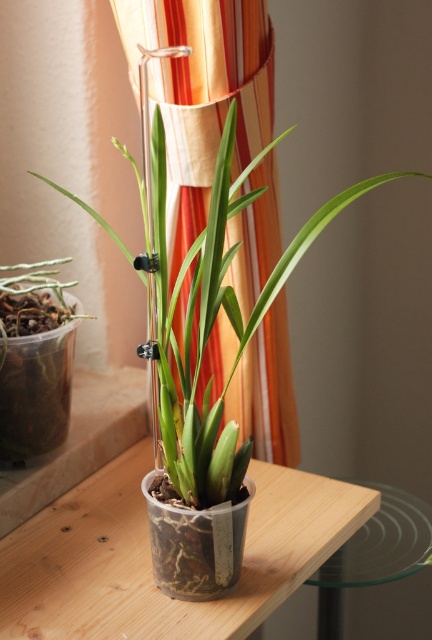
Looking at this image, you are standing in front of the potted plant. Where is the green matte plant at center located relative to the point marked at coordinates (212, 308)?

The green matte plant at center is located exactly at the point marked at coordinates (212, 308).

You are a delivery person trying to place a package on the wooden table at center. The package is 75 centimeters wide. Will it fit on the table?

The package is 75 centimeters wide, and the distance between them is 74.96 centimeters, so it will not fit.

You are standing in front of the potted orchid on the wooden surface. If you were to draw a line from the orchid to the point at coordinates point [149,557], which object would that line intersect first?

The line drawn from the orchid to point [149,557] would first intersect the wooden table at center, as the point itself indicates the location of the wooden table at center.